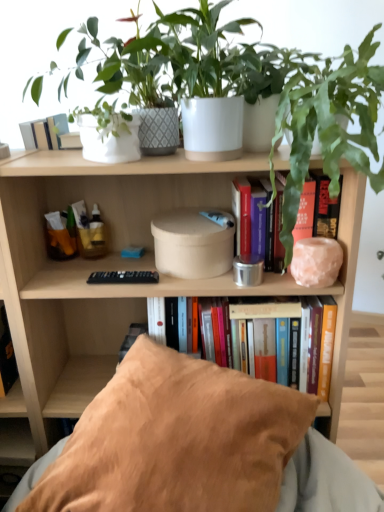
What do you see at coordinates (262, 310) in the screenshot? Image resolution: width=384 pixels, height=512 pixels. I see `hardcover book at center, the 1th book from the bottom` at bounding box center [262, 310].

Locate an element on the screen. This screenshot has height=512, width=384. hardcover book at center, placed as the 2th book when sorted from bottom to top is located at coordinates (316, 210).

What is the approximate height of matte cardboard box at center?

1.07 meters.

How much space does white ceramic pot at upper center, which appears as the 2th houseplant when viewed from the right, occupy vertically?

The height of white ceramic pot at upper center, which appears as the 2th houseplant when viewed from the right, is 13.54 inches.

This screenshot has height=512, width=384. Describe the element at coordinates (176, 440) in the screenshot. I see `beige fabric pillow at lower center` at that location.

Identify the location of hardcover book at center, the 2th book when ordered from top to bottom. (262, 310).

Choose the correct answer: Is hardcover book at center, the 2th book when ordered from top to bottom, inside white ceramic pot at upper center, placed as the 1th houseplant when sorted from left to right, or outside it?

hardcover book at center, the 2th book when ordered from top to bottom, cannot be found inside white ceramic pot at upper center, placed as the 1th houseplant when sorted from left to right.

From the picture: From the image's perspective, is hardcover book at center, the 2th book when ordered from top to bottom, positioned above or below white ceramic pot at upper center, placed as the 1th houseplant when sorted from left to right?

hardcover book at center, the 2th book when ordered from top to bottom, is situated lower than white ceramic pot at upper center, placed as the 1th houseplant when sorted from left to right, in the image.

Considering their positions, is hardcover book at center, the 2th book when ordered from top to bottom, located in front of or behind white ceramic pot at upper center, which appears as the 2th houseplant when viewed from the right?

Visually, hardcover book at center, the 2th book when ordered from top to bottom, is located behind white ceramic pot at upper center, which appears as the 2th houseplant when viewed from the right.

Which of these two, hardcover book at center, the 2th book when ordered from top to bottom, or white ceramic pot at upper center, placed as the 1th houseplant when sorted from left to right, is wider?

With larger width is white ceramic pot at upper center, placed as the 1th houseplant when sorted from left to right.

From a real-world perspective, which object stands above the other?

green leafy plant at upper right, which is counted as the second houseplant, starting from the left, is physically above.

Which point is more distant from viewer, (x=300, y=102) or (x=322, y=354)?

Positioned behind is point (x=322, y=354).

How far apart are green leafy plant at upper right, the 1th houseplant when ordered from right to left, and hardcover book at center, the 2th book when ordered from top to bottom?

green leafy plant at upper right, the 1th houseplant when ordered from right to left, is 16.82 inches away from hardcover book at center, the 2th book when ordered from top to bottom.

Can you confirm if green leafy plant at upper right, which is counted as the second houseplant, starting from the left, is wider than hardcover book at center, the 1th book from the bottom?

Correct, the width of green leafy plant at upper right, which is counted as the second houseplant, starting from the left, exceeds that of hardcover book at center, the 1th book from the bottom.

Is hardcover book at center, placed as the 2th book when sorted from bottom to top, closer to the viewer compared to hardcover book at center, the 1th book from the bottom?

Yes, it is.

Is hardcover book at center, the 2th book when ordered from top to bottom, located within hardcover book at center, placed as the 2th book when sorted from bottom to top?

Actually, hardcover book at center, the 2th book when ordered from top to bottom, is outside hardcover book at center, placed as the 2th book when sorted from bottom to top.

Is hardcover book at center, the 1th book viewed from the top, beside hardcover book at center, the 2th book when ordered from top to bottom?

No, hardcover book at center, the 1th book viewed from the top, is not making contact with hardcover book at center, the 2th book when ordered from top to bottom.

Who is bigger, hardcover book at center, placed as the 2th book when sorted from bottom to top, or hardcover book at center, the 2th book when ordered from top to bottom?

hardcover book at center, the 2th book when ordered from top to bottom, is bigger.

Which is less distant, (292, 446) or (190, 106)?

Point (292, 446) appears to be closer to the viewer than point (190, 106).

Can you confirm if beige fabric pillow at lower center is wider than white ceramic pot at upper center, placed as the 1th houseplant when sorted from left to right?

Indeed, beige fabric pillow at lower center has a greater width compared to white ceramic pot at upper center, placed as the 1th houseplant when sorted from left to right.

From a real-world perspective, is beige fabric pillow at lower center over white ceramic pot at upper center, which appears as the 2th houseplant when viewed from the right?

No, from a real-world perspective, beige fabric pillow at lower center is not on top of white ceramic pot at upper center, which appears as the 2th houseplant when viewed from the right.

Does beige fabric pillow at lower center have a lesser height compared to white ceramic pot at upper center, placed as the 1th houseplant when sorted from left to right?

Correct, beige fabric pillow at lower center is not as tall as white ceramic pot at upper center, placed as the 1th houseplant when sorted from left to right.

Considering the positions of objects matte cardboard box at center and hardcover book at center, placed as the 2th book when sorted from bottom to top, in the image provided, who is more to the left, matte cardboard box at center or hardcover book at center, placed as the 2th book when sorted from bottom to top,?

From the viewer's perspective, matte cardboard box at center appears more on the left side.

Is matte cardboard box at center taller than hardcover book at center, the 1th book viewed from the top?

Yes, matte cardboard box at center is taller than hardcover book at center, the 1th book viewed from the top.

Does matte cardboard box at center touch hardcover book at center, placed as the 2th book when sorted from bottom to top?

No, matte cardboard box at center is not next to hardcover book at center, placed as the 2th book when sorted from bottom to top.

Do you think matte cardboard box at center is within hardcover book at center, the 1th book viewed from the top, or outside of it?

matte cardboard box at center is not enclosed by hardcover book at center, the 1th book viewed from the top.

From a real-world perspective, is matte cardboard box at center above or below green leafy plant at upper right, the 1th houseplant when ordered from right to left?

In terms of real-world spatial position, matte cardboard box at center is below green leafy plant at upper right, the 1th houseplant when ordered from right to left.

Is matte cardboard box at center aimed at green leafy plant at upper right, which is counted as the second houseplant, starting from the left?

No, matte cardboard box at center is not aimed at green leafy plant at upper right, which is counted as the second houseplant, starting from the left.

Is matte cardboard box at center taller or shorter than green leafy plant at upper right, which is counted as the second houseplant, starting from the left?

matte cardboard box at center is taller than green leafy plant at upper right, which is counted as the second houseplant, starting from the left.

Considering the positions of objects matte cardboard box at center and green leafy plant at upper right, which is counted as the second houseplant, starting from the left, in the image provided, who is behind, matte cardboard box at center or green leafy plant at upper right, which is counted as the second houseplant, starting from the left,?

matte cardboard box at center is further from the camera.

Considering the relative sizes of matte cardboard box at center and white ceramic pot at upper center, placed as the 1th houseplant when sorted from left to right, in the image provided, is matte cardboard box at center shorter than white ceramic pot at upper center, placed as the 1th houseplant when sorted from left to right,?

No.

Would you say matte cardboard box at center is inside or outside white ceramic pot at upper center, which appears as the 2th houseplant when viewed from the right?

The correct answer is: outside.

Which is in front, point (33, 366) or point (200, 112)?

The point (200, 112) is closer to the camera.

From the image's perspective, is matte cardboard box at center on top of white ceramic pot at upper center, which appears as the 2th houseplant when viewed from the right?

No, from the image's perspective, matte cardboard box at center is not above white ceramic pot at upper center, which appears as the 2th houseplant when viewed from the right.

This screenshot has width=384, height=512. There is a hardcover book at center, the 2th book when ordered from top to bottom. Find the location of `the 2nd houseplant above it (from the image's perspective)`. the 2nd houseplant above it (from the image's perspective) is located at coordinates (208, 80).

In order to click on the 2nd houseplant in front of the hardcover book at center, the 1th book from the bottom, counting from the anchor's position in this screenshot , I will do `click(328, 119)`.

Which object lies nearer to the anchor point hardcover book at center, the 2th book when ordered from top to bottom, white ceramic pot at upper center, which appears as the 2th houseplant when viewed from the right, or green leafy plant at upper right, which is counted as the second houseplant, starting from the left?

green leafy plant at upper right, which is counted as the second houseplant, starting from the left, is positioned closer to the anchor hardcover book at center, the 2th book when ordered from top to bottom.

Considering their positions, is beige fabric pillow at lower center positioned closer to hardcover book at center, placed as the 2th book when sorted from bottom to top, than white ceramic pot at upper center, which appears as the 2th houseplant when viewed from the right?

The object closer to hardcover book at center, placed as the 2th book when sorted from bottom to top, is white ceramic pot at upper center, which appears as the 2th houseplant when viewed from the right.

When comparing their distances from hardcover book at center, the 1th book viewed from the top, does matte cardboard box at center or green leafy plant at upper right, the 1th houseplant when ordered from right to left, seem further?

Among the two, matte cardboard box at center is located further to hardcover book at center, the 1th book viewed from the top.

When comparing their distances from matte cardboard box at center, does green leafy plant at upper right, which is counted as the second houseplant, starting from the left, or beige fabric pillow at lower center seem closer?

green leafy plant at upper right, which is counted as the second houseplant, starting from the left, is closer to matte cardboard box at center.

Looking at the image, which one is located further to hardcover book at center, the 1th book from the bottom, matte cardboard box at center or hardcover book at center, placed as the 2th book when sorted from bottom to top?

Among the two, matte cardboard box at center is located further to hardcover book at center, the 1th book from the bottom.

Looking at the image, which one is located further to white ceramic pot at upper center, which appears as the 2th houseplant when viewed from the right, matte cardboard box at center or green leafy plant at upper right, the 1th houseplant when ordered from right to left?

matte cardboard box at center is further to white ceramic pot at upper center, which appears as the 2th houseplant when viewed from the right.

Estimate the real-world distances between objects in this image. Which object is closer to white ceramic pot at upper center, which appears as the 2th houseplant when viewed from the right, hardcover book at center, the 1th book from the bottom, or beige fabric pillow at lower center?

Among the two, hardcover book at center, the 1th book from the bottom, is located nearer to white ceramic pot at upper center, which appears as the 2th houseplant when viewed from the right.

When comparing their distances from matte cardboard box at center, does hardcover book at center, the 2th book when ordered from top to bottom, or white ceramic pot at upper center, which appears as the 2th houseplant when viewed from the right, seem closer?

The object closer to matte cardboard box at center is hardcover book at center, the 2th book when ordered from top to bottom.

The width and height of the screenshot is (384, 512). Find the location of `houseplant between white ceramic pot at upper center, which appears as the 2th houseplant when viewed from the right, and matte cardboard box at center, in the vertical direction`. houseplant between white ceramic pot at upper center, which appears as the 2th houseplant when viewed from the right, and matte cardboard box at center, in the vertical direction is located at coordinates (328, 119).

Image resolution: width=384 pixels, height=512 pixels. In order to click on book between green leafy plant at upper right, the 1th houseplant when ordered from right to left, and hardcover book at center, the 2th book when ordered from top to bottom, in the front-back direction in this screenshot , I will do point(316,210).

Find the location of a particular element. The image size is (384, 512). book located between beige fabric pillow at lower center and hardcover book at center, the 1th book from the bottom, in the depth direction is located at coordinates (316, 210).

Where is `houseplant located between green leafy plant at upper right, which is counted as the second houseplant, starting from the left, and hardcover book at center, the 1th book viewed from the top, in the depth direction`? The width and height of the screenshot is (384, 512). houseplant located between green leafy plant at upper right, which is counted as the second houseplant, starting from the left, and hardcover book at center, the 1th book viewed from the top, in the depth direction is located at coordinates (208, 80).